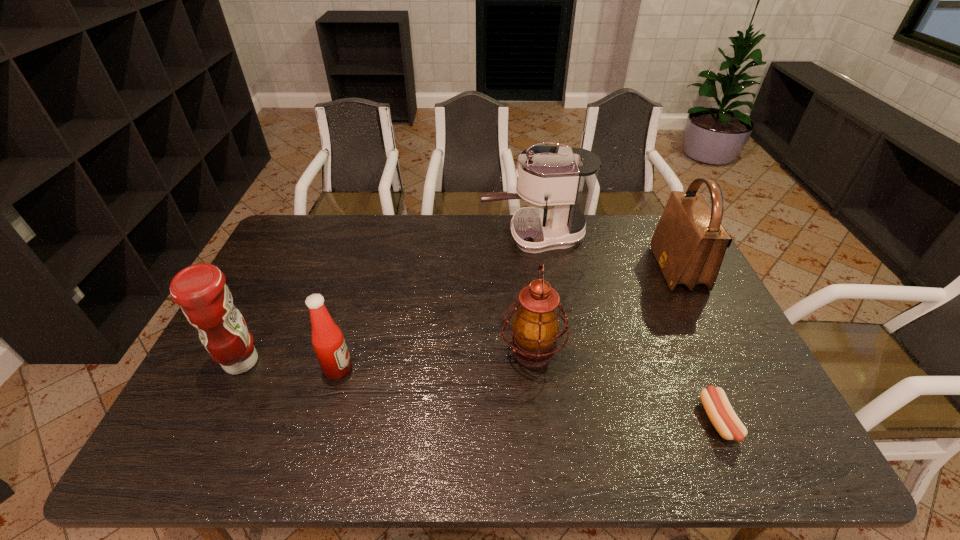
The width and height of the screenshot is (960, 540). What are the coordinates of `vacant point located 0.320m on the front-facing side of the coffee maker` in the screenshot? It's located at (391, 237).

Image resolution: width=960 pixels, height=540 pixels. In order to click on vacant space positioned on the front flap of the shoulder bag in this screenshot , I will do `click(572, 268)`.

Where is `vacant space located on the front flap of the shoulder bag`? vacant space located on the front flap of the shoulder bag is located at coordinates coord(627,268).

The width and height of the screenshot is (960, 540). In order to click on vacant area situated on the front flap of the shoulder bag in this screenshot , I will do (x=603, y=268).

Identify the location of vacant space located on the back of the oil lamp. The width and height of the screenshot is (960, 540). (522, 260).

Image resolution: width=960 pixels, height=540 pixels. I want to click on vacant space located on the front of the left condiment, so click(208, 429).

Where is `free region located on the front-facing side of the right condiment`? The width and height of the screenshot is (960, 540). free region located on the front-facing side of the right condiment is located at coordinates (482, 369).

The image size is (960, 540). Find the location of `free spot located on the left of the nearest object`. free spot located on the left of the nearest object is located at coordinates (645, 421).

Where is `coffee maker that is positioned at the far edge`? coffee maker that is positioned at the far edge is located at coordinates (564, 178).

This screenshot has height=540, width=960. Find the location of `shoulder bag at the far edge`. shoulder bag at the far edge is located at coordinates (689, 243).